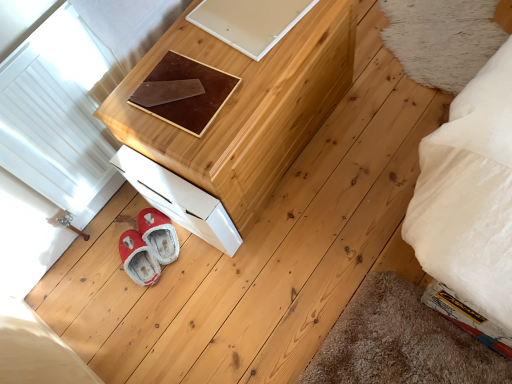
What is the approximate width of white glossy drawer at lower left?

The width of white glossy drawer at lower left is 15.49 inches.

The image size is (512, 384). In order to click on brown leather pad at center in this screenshot , I will do `click(184, 93)`.

Considering the sizes of objects fuzzy red slippers at lower left and white glossy drawer at lower left in the image provided, who is wider, fuzzy red slippers at lower left or white glossy drawer at lower left?

white glossy drawer at lower left is wider.

Is fuzzy red slippers at lower left not inside white glossy drawer at lower left?

Indeed, fuzzy red slippers at lower left is completely outside white glossy drawer at lower left.

Is point (153, 284) more distant than point (172, 216)?

Yes, it is.

Is fuzzy red slippers at lower left further to the viewer compared to white glossy drawer at lower left?

That is True.

From a real-world perspective, between white glossy drawer at lower left and fuzzy red slippers at lower left, who is vertically higher?

white glossy drawer at lower left, from a real-world perspective.

Is white glossy drawer at lower left wider or thinner than fuzzy red slippers at lower left?

Considering their sizes, white glossy drawer at lower left looks broader than fuzzy red slippers at lower left.

Are white glossy drawer at lower left and fuzzy red slippers at lower left far apart?

No.

Is white glossy drawer at lower left further to camera compared to fuzzy red slippers at lower left?

No.

Is white glossy drawer at lower left positioned with its back to natural wood chest of drawers at upper center?

No, white glossy drawer at lower left's orientation is not away from natural wood chest of drawers at upper center.

Does white glossy drawer at lower left lie behind natural wood chest of drawers at upper center?

That is True.

Between white glossy drawer at lower left and natural wood chest of drawers at upper center, which one has smaller width?

white glossy drawer at lower left.

Between natural wood chest of drawers at upper center and white glossy drawer at lower left, which one is positioned in front?

natural wood chest of drawers at upper center is more forward.

How far apart are natural wood chest of drawers at upper center and white glossy drawer at lower left?

natural wood chest of drawers at upper center and white glossy drawer at lower left are 8.26 inches apart from each other.

Are natural wood chest of drawers at upper center and white glossy drawer at lower left located far from each other?

Result: natural wood chest of drawers at upper center is actually quite close to white glossy drawer at lower left.

Is natural wood chest of drawers at upper center smaller than white glossy drawer at lower left?

Incorrect, natural wood chest of drawers at upper center is not smaller in size than white glossy drawer at lower left.

Would you say brown leather pad at center is inside or outside white glossy drawer at lower left?

brown leather pad at center exists outside the volume of white glossy drawer at lower left.

Which object is positioned more to the left, brown leather pad at center or white glossy drawer at lower left?

white glossy drawer at lower left.

Where is `pad on the right of white glossy drawer at lower left`? This screenshot has height=384, width=512. pad on the right of white glossy drawer at lower left is located at coordinates (184, 93).

From the image's perspective, between brown leather pad at center and white glossy drawer at lower left, which one is located above?

brown leather pad at center appears higher in the image.

Is brown leather pad at center located within natural wood chest of drawers at upper center?

No, brown leather pad at center is not inside natural wood chest of drawers at upper center.

Which of these two, natural wood chest of drawers at upper center or brown leather pad at center, is wider?

natural wood chest of drawers at upper center is wider.

Considering the relative positions of natural wood chest of drawers at upper center and brown leather pad at center in the image provided, is natural wood chest of drawers at upper center to the left or to the right of brown leather pad at center?

natural wood chest of drawers at upper center is positioned on brown leather pad at center's right side.

From the image's perspective, between natural wood chest of drawers at upper center and fuzzy red slippers at lower left, who is located below?

fuzzy red slippers at lower left is shown below in the image.

Which object is closer to the camera, natural wood chest of drawers at upper center or fuzzy red slippers at lower left?

natural wood chest of drawers at upper center is more forward.

Identify the location of furniture that appears on the right of fuzzy red slippers at lower left. This screenshot has height=384, width=512. (244, 110).

Which point is more distant from viewer, (307,107) or (148,268)?

Positioned behind is point (148,268).

Find the location of a particular element. This screenshot has width=512, height=384. drawer lying on the right of fuzzy red slippers at lower left is located at coordinates (179, 200).

The height and width of the screenshot is (384, 512). What are the coordinates of `footwear lying behind the white glossy drawer at lower left` in the screenshot? It's located at (138, 259).

From the image, which object appears to be nearer to fuzzy red slippers at lower left, brown leather pad at center or white glossy drawer at lower left?

white glossy drawer at lower left is closer to fuzzy red slippers at lower left.

In the scene shown: Estimate the real-world distances between objects in this image. Which object is further from fuzzy red slippers at lower left, white glossy drawer at lower left or natural wood chest of drawers at upper center?

Based on the image, natural wood chest of drawers at upper center appears to be further to fuzzy red slippers at lower left.

Looking at the image, which one is located closer to fuzzy red slippers at lower left, natural wood chest of drawers at upper center or brown leather pad at center?

natural wood chest of drawers at upper center is positioned closer to the anchor fuzzy red slippers at lower left.

Looking at this image, which object lies further to the anchor point natural wood chest of drawers at upper center, white glossy drawer at lower left or fuzzy red slippers at lower left?

Among the two, fuzzy red slippers at lower left is located further to natural wood chest of drawers at upper center.

Considering their positions, is natural wood chest of drawers at upper center positioned closer to white glossy drawer at lower left than fuzzy red slippers at lower left?

natural wood chest of drawers at upper center.

From the image, which object appears to be nearer to natural wood chest of drawers at upper center, brown leather pad at center or fuzzy red slippers at lower left?

brown leather pad at center is positioned closer to the anchor natural wood chest of drawers at upper center.

In the scene shown: Looking at the image, which one is located further to white glossy drawer at lower left, fuzzy red slippers at lower left or brown leather pad at center?

fuzzy red slippers at lower left.

When comparing their distances from brown leather pad at center, does fuzzy red slippers at lower left or white glossy drawer at lower left seem closer?

white glossy drawer at lower left is positioned closer to the anchor brown leather pad at center.

Locate an element on the screen. drawer between natural wood chest of drawers at upper center and fuzzy red slippers at lower left vertically is located at coordinates (179, 200).

Locate an element on the screen. drawer that lies between brown leather pad at center and fuzzy red slippers at lower left from top to bottom is located at coordinates (179, 200).

Image resolution: width=512 pixels, height=384 pixels. I want to click on pad that lies between natural wood chest of drawers at upper center and fuzzy red slippers at lower left from top to bottom, so click(x=184, y=93).

Image resolution: width=512 pixels, height=384 pixels. I want to click on pad that lies between natural wood chest of drawers at upper center and white glossy drawer at lower left from top to bottom, so click(184, 93).